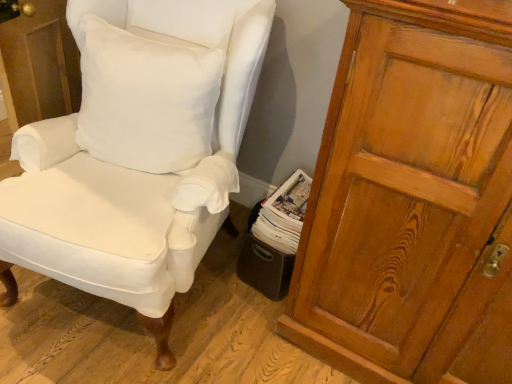
Question: Is white cotton pillow at upper left positioned with its back to white paper magazine at lower center?

Choices:
 (A) yes
 (B) no

Answer: (B)

Question: Is white cotton pillow at upper left further to camera compared to white paper magazine at lower center?

Choices:
 (A) yes
 (B) no

Answer: (B)

Question: Is white paper magazine at lower center a part of white cotton pillow at upper left?

Choices:
 (A) yes
 (B) no

Answer: (B)

Question: Does white cotton pillow at upper left appear on the left side of white paper magazine at lower center?

Choices:
 (A) no
 (B) yes

Answer: (B)

Question: Can you confirm if white cotton pillow at upper left is wider than white paper magazine at lower center?

Choices:
 (A) yes
 (B) no

Answer: (B)

Question: Based on their positions, is white cotton pillow at upper left located to the left or right of wooden cupboard at right?

Choices:
 (A) left
 (B) right

Answer: (A)

Question: Looking at their shapes, would you say white cotton pillow at upper left is wider or thinner than wooden cupboard at right?

Choices:
 (A) thin
 (B) wide

Answer: (A)

Question: Considering the positions of point (164, 125) and point (408, 44), is point (164, 125) closer or farther from the camera than point (408, 44)?

Choices:
 (A) farther
 (B) closer

Answer: (A)

Question: Is white cotton pillow at upper left inside or outside of wooden cupboard at right?

Choices:
 (A) outside
 (B) inside

Answer: (A)

Question: From the image's perspective, is white fabric chair at center above or below wooden cupboard at right?

Choices:
 (A) above
 (B) below

Answer: (A)

Question: In the image, is white fabric chair at center positioned in front of or behind wooden cupboard at right?

Choices:
 (A) behind
 (B) front

Answer: (A)

Question: From a real-world perspective, is white fabric chair at center physically located above or below wooden cupboard at right?

Choices:
 (A) below
 (B) above

Answer: (A)

Question: In terms of height, does white fabric chair at center look taller or shorter compared to wooden cupboard at right?

Choices:
 (A) short
 (B) tall

Answer: (A)

Question: From a real-world perspective, is wooden cupboard at right positioned above or below white paper magazine at lower center?

Choices:
 (A) above
 (B) below

Answer: (A)

Question: Considering the positions of wooden cupboard at right and white paper magazine at lower center in the image, is wooden cupboard at right wider or thinner than white paper magazine at lower center?

Choices:
 (A) wide
 (B) thin

Answer: (A)